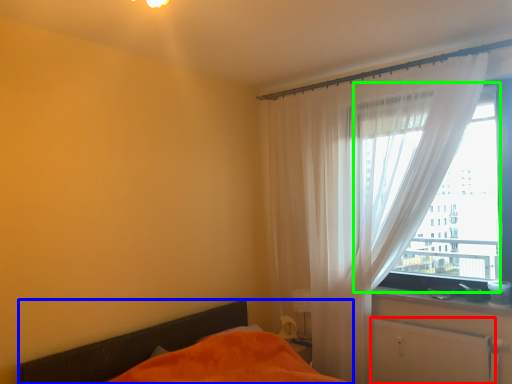
Question: Which is farther away from radiator (highlighted by a red box)? bed (highlighted by a blue box) or window (highlighted by a green box)?

Choices:
 (A) bed
 (B) window

Answer: (A)